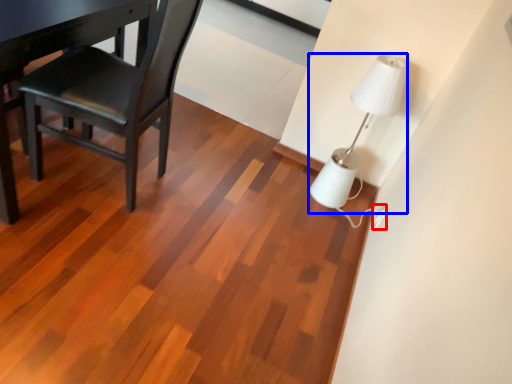
Question: Which of the following is the farthest to the observer, electric outlet (highlighted by a red box) or lamp (highlighted by a blue box)?

Choices:
 (A) electric outlet
 (B) lamp

Answer: (A)